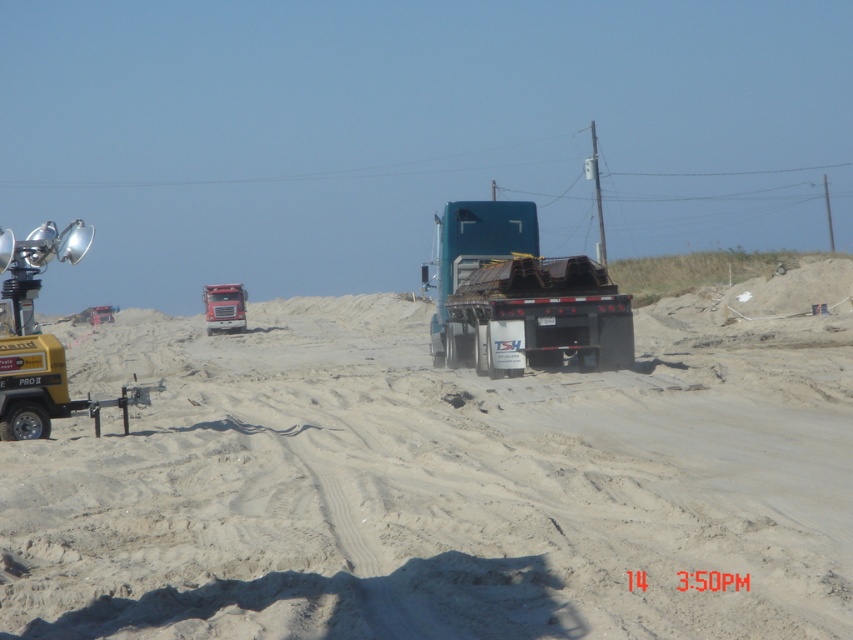
Question: Observing the image, what is the correct spatial positioning of yellow metallic light at left in reference to matte red truck at center?

Choices:
 (A) left
 (B) right

Answer: (A)

Question: Is sandy dirt field at center below yellow metallic light at left?

Choices:
 (A) yes
 (B) no

Answer: (A)

Question: Which object is farther from the camera taking this photo?

Choices:
 (A) yellow metallic light at left
 (B) matte red truck at center
 (C) sandy dirt field at center

Answer: (B)

Question: Which of the following is the farthest from the observer?

Choices:
 (A) (579, 278)
 (B) (260, 573)

Answer: (A)

Question: Which object is closer to the camera taking this photo?

Choices:
 (A) teal matte trailer truck at center
 (B) sandy dirt field at center
 (C) yellow metallic light at left

Answer: (B)

Question: Is sandy dirt field at center behind teal matte trailer truck at center?

Choices:
 (A) yes
 (B) no

Answer: (B)